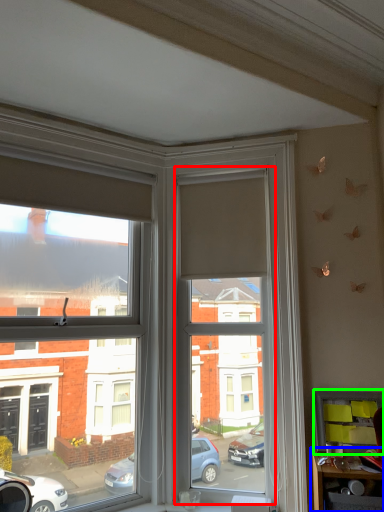
Question: Which object is the farthest from window screen (highlighted by a red box)? Choose among these: table (highlighted by a blue box) or shelf (highlighted by a green box).

Choices:
 (A) table
 (B) shelf

Answer: (A)